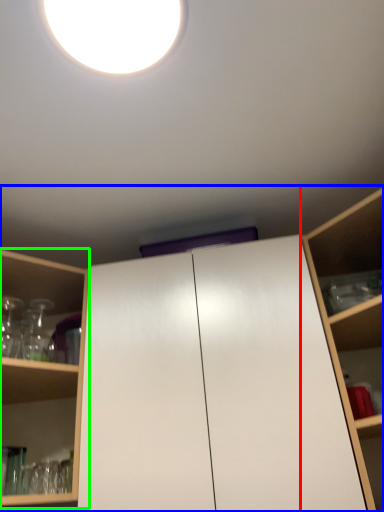
Question: Which object is the closest to the shelf (highlighted by a red box)? Choose among these: cabinetry (highlighted by a blue box) or shelf (highlighted by a green box).

Choices:
 (A) cabinetry
 (B) shelf

Answer: (A)